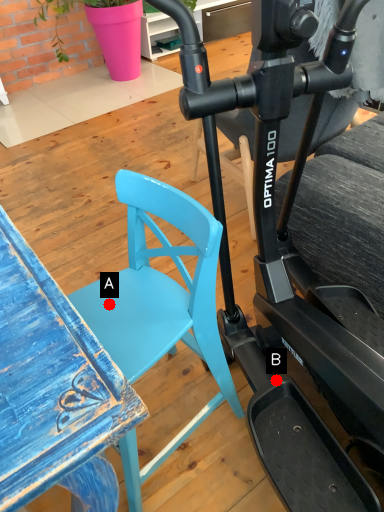
Question: Two points are circled on the image, labeled by A and B beside each circle. Which of the following is the farthest from the observer?

Choices:
 (A) A is further
 (B) B is further

Answer: (B)